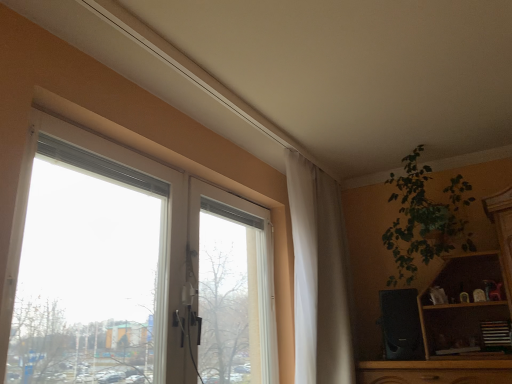
What do you see at coordinates (319, 276) in the screenshot? This screenshot has width=512, height=384. I see `white sheer curtain at center` at bounding box center [319, 276].

Measure the distance between point (339,327) and camera.

Point (339,327) and camera are 2.48 meters apart from each other.

Find the location of `white sheer curtain at center`. white sheer curtain at center is located at coordinates 319,276.

Which object is closer to the camera, green leafy plant at upper right or white sheer curtain at center?

white sheer curtain at center.

Which object is thinner, green leafy plant at upper right or white sheer curtain at center?

Thinner between the two is white sheer curtain at center.

What's the angular difference between green leafy plant at upper right and white sheer curtain at center's facing directions?

The angle between the facing direction of green leafy plant at upper right and the facing direction of white sheer curtain at center is 90 degrees.

From a real-world perspective, is green leafy plant at upper right physically located above or below white sheer curtain at center?

green leafy plant at upper right is above white sheer curtain at center.

From the image's perspective, between transparent glass window at upper left and green leafy plant at upper right, who is located below?

transparent glass window at upper left, from the image's perspective.

Considering the sizes of objects transparent glass window at upper left and green leafy plant at upper right in the image provided, who is bigger, transparent glass window at upper left or green leafy plant at upper right?

With larger size is transparent glass window at upper left.

Is there a large distance between transparent glass window at upper left and green leafy plant at upper right?

Yes.

Measure the distance from transparent glass window at upper left to white sheer curtain at center.

transparent glass window at upper left is 61.13 centimeters from white sheer curtain at center.

Can you tell me how much transparent glass window at upper left and white sheer curtain at center differ in facing direction?

There is a 0.000954-degree angle between the facing directions of transparent glass window at upper left and white sheer curtain at center.

Are transparent glass window at upper left and white sheer curtain at center far apart?

No, transparent glass window at upper left is not far from white sheer curtain at center.

Which is farther from the camera, [144,164] or [308,383]?

Positioned behind is point [308,383].

Is transparent glass window at upper left inside white sheer curtain at center?

Actually, transparent glass window at upper left is outside white sheer curtain at center.

From the image's perspective, which object appears higher, white sheer curtain at center or transparent glass window at upper left?

transparent glass window at upper left is shown above in the image.

Considering the sizes of objects white sheer curtain at center and transparent glass window at upper left in the image provided, who is wider, white sheer curtain at center or transparent glass window at upper left?

white sheer curtain at center is wider.

From the image's perspective, between green leafy plant at upper right and transparent glass window at upper left, who is located below?

transparent glass window at upper left, from the image's perspective.

Is green leafy plant at upper right facing towards transparent glass window at upper left?

No, green leafy plant at upper right is not oriented towards transparent glass window at upper left.

Considering the sizes of objects green leafy plant at upper right and transparent glass window at upper left in the image provided, who is smaller, green leafy plant at upper right or transparent glass window at upper left?

green leafy plant at upper right is smaller.

From a real-world perspective, is green leafy plant at upper right positioned above or below transparent glass window at upper left?

green leafy plant at upper right is situated higher than transparent glass window at upper left in the real world.

Locate an element on the screen. curtain below the green leafy plant at upper right (from the image's perspective) is located at coordinates (319, 276).

From the image's perspective, which object appears higher, white sheer curtain at center or green leafy plant at upper right?

From the image's view, green leafy plant at upper right is above.

Based on the photo, which object is wider, white sheer curtain at center or green leafy plant at upper right?

Wider between the two is green leafy plant at upper right.

The image size is (512, 384). I want to click on houseplant above the white sheer curtain at center (from the image's perspective), so click(424, 220).

This screenshot has height=384, width=512. In the image, there is a green leafy plant at upper right. In order to click on window below it (from the image's perspective) in this screenshot , I will do `click(127, 268)`.

Based on their spatial positions, is transparent glass window at upper left or green leafy plant at upper right further from white sheer curtain at center?

Based on the image, transparent glass window at upper left appears to be further to white sheer curtain at center.

Estimate the real-world distances between objects in this image. Which object is further from green leafy plant at upper right, transparent glass window at upper left or white sheer curtain at center?

Among the two, transparent glass window at upper left is located further to green leafy plant at upper right.

Based on their spatial positions, is green leafy plant at upper right or transparent glass window at upper left further from white sheer curtain at center?

transparent glass window at upper left.

Estimate the real-world distances between objects in this image. Which object is further from transparent glass window at upper left, white sheer curtain at center or green leafy plant at upper right?

green leafy plant at upper right is positioned further to the anchor transparent glass window at upper left.

Based on their spatial positions, is white sheer curtain at center or transparent glass window at upper left further from green leafy plant at upper right?

transparent glass window at upper left is positioned further to the anchor green leafy plant at upper right.

Considering their positions, is green leafy plant at upper right positioned further to transparent glass window at upper left than white sheer curtain at center?

green leafy plant at upper right lies further to transparent glass window at upper left than the other object.

Locate an element on the screen. curtain between transparent glass window at upper left and green leafy plant at upper right in the horizontal direction is located at coordinates (319, 276).